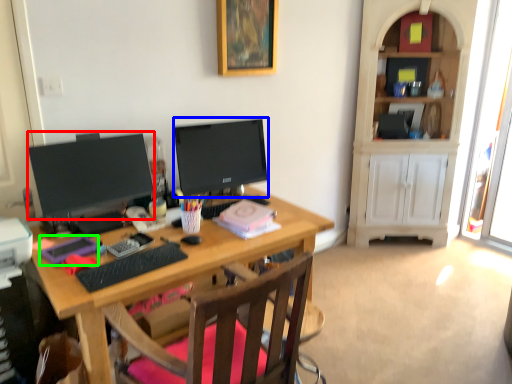
Question: Which object is positioned farthest from television (highlighted by a red box)? Select from television (highlighted by a blue box) and stationery (highlighted by a green box).

Choices:
 (A) television
 (B) stationery

Answer: (A)